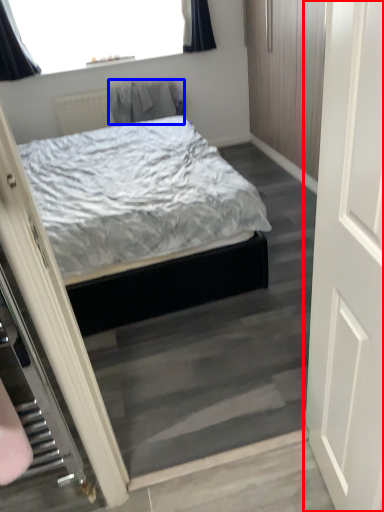
Question: Which object is closer to the camera taking this photo, door (highlighted by a red box) or robe (highlighted by a blue box)?

Choices:
 (A) door
 (B) robe

Answer: (A)